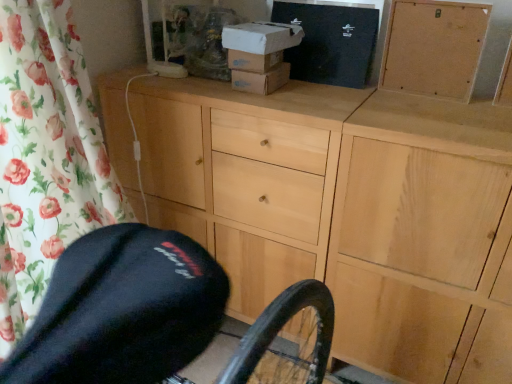
Question: Looking at the image, does light wood cabinet at center seem bigger or smaller compared to corkboard at upper right?

Choices:
 (A) small
 (B) big

Answer: (B)

Question: Considering their positions, is light wood cabinet at center located in front of or behind corkboard at upper right?

Choices:
 (A) front
 (B) behind

Answer: (A)

Question: Which is nearer to the light wood cabinet at center?

Choices:
 (A) corkboard at upper right
 (B) black cardboard box at upper center, marked as the 1th box in a right-to-left arrangement
 (C) white cardboard box at upper center, the second box when ordered from right to left

Answer: (C)

Question: Which object is positioned closest to the light wood cabinet at center?

Choices:
 (A) white cardboard box at upper center, the second box when ordered from right to left
 (B) corkboard at upper right
 (C) black cardboard box at upper center, which ranks as the second box in left-to-right order

Answer: (A)